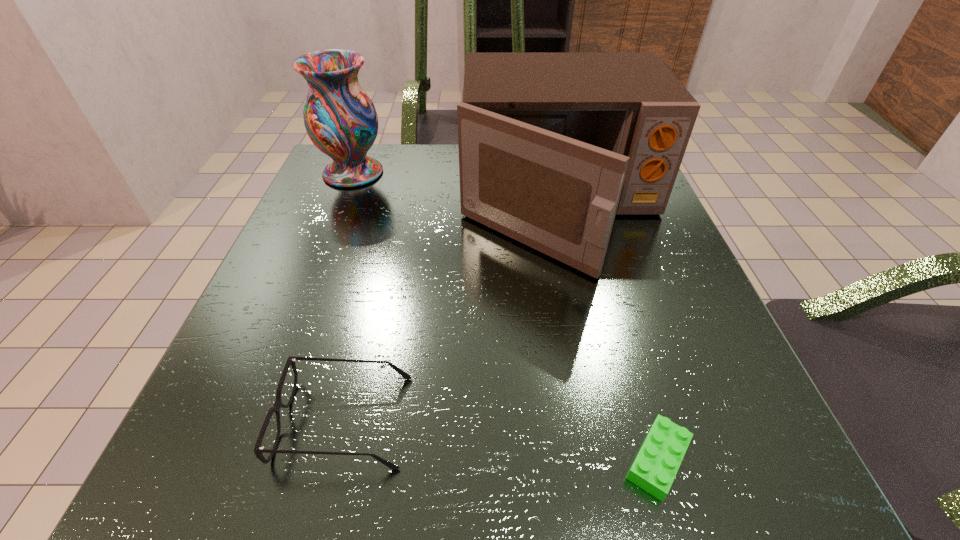
Where is `spectacles located at the near edge`? The width and height of the screenshot is (960, 540). spectacles located at the near edge is located at coordinates (258, 450).

The height and width of the screenshot is (540, 960). I want to click on Lego positioned at the near edge, so click(656, 465).

The height and width of the screenshot is (540, 960). I want to click on vase at the left edge, so tap(340, 119).

Locate an element on the screen. spectacles that is at the left edge is located at coordinates (258, 450).

The height and width of the screenshot is (540, 960). What are the coordinates of `microwave oven present at the right edge` in the screenshot? It's located at (552, 146).

I want to click on Lego located at the right edge, so click(x=656, y=465).

Where is `object that is at the far left corner`? object that is at the far left corner is located at coordinates (340, 119).

Identify the location of object that is at the near left corner. Image resolution: width=960 pixels, height=540 pixels. (258, 450).

The image size is (960, 540). I want to click on object that is positioned at the far right corner, so coord(552,146).

At what (x,y) coordinates should I click in order to perform the action: click on object that is at the near right corner. Please return your answer as a coordinate pair (x, y). Looking at the image, I should click on (656, 465).